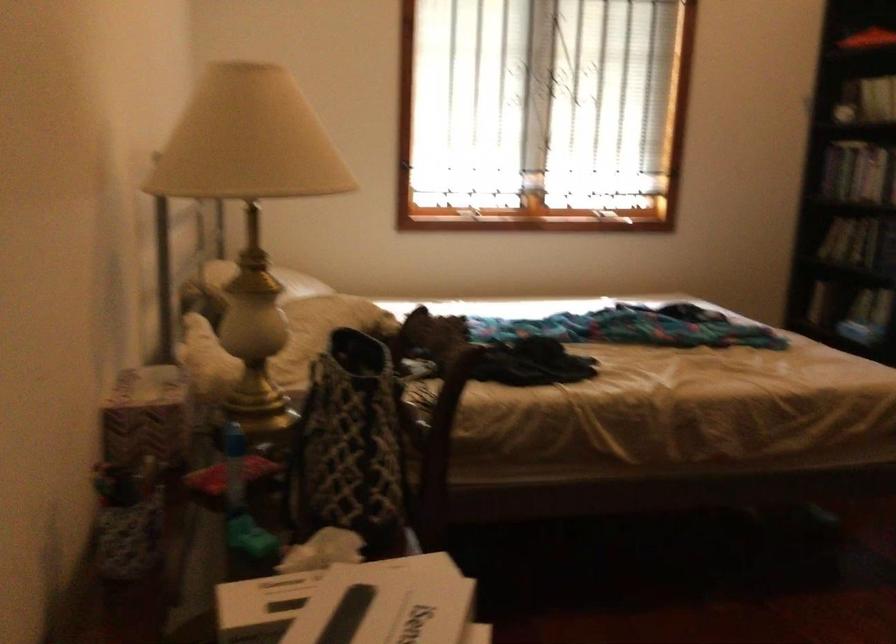
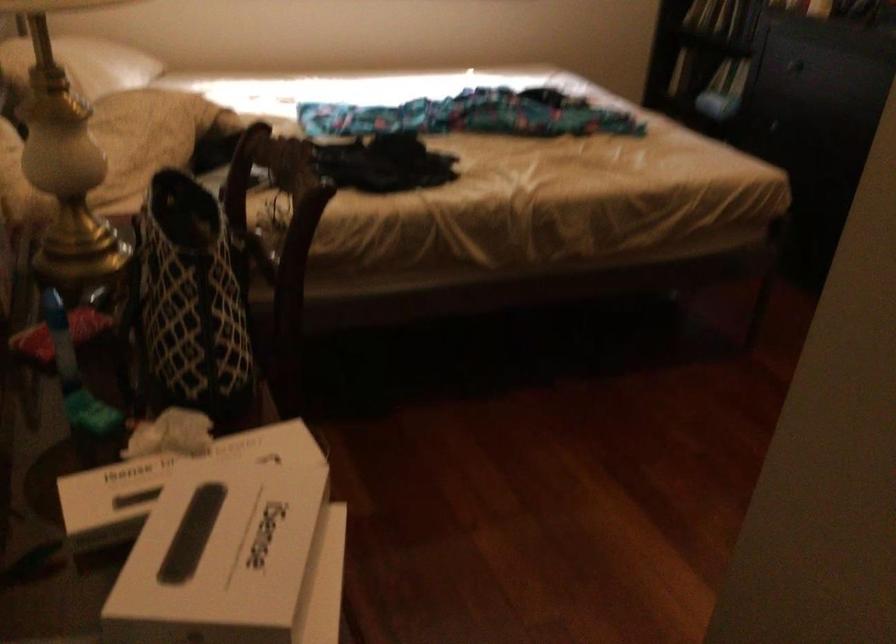
The point at [273,281] is marked in the first image. Where is the corresponding point in the second image?

(82, 64)